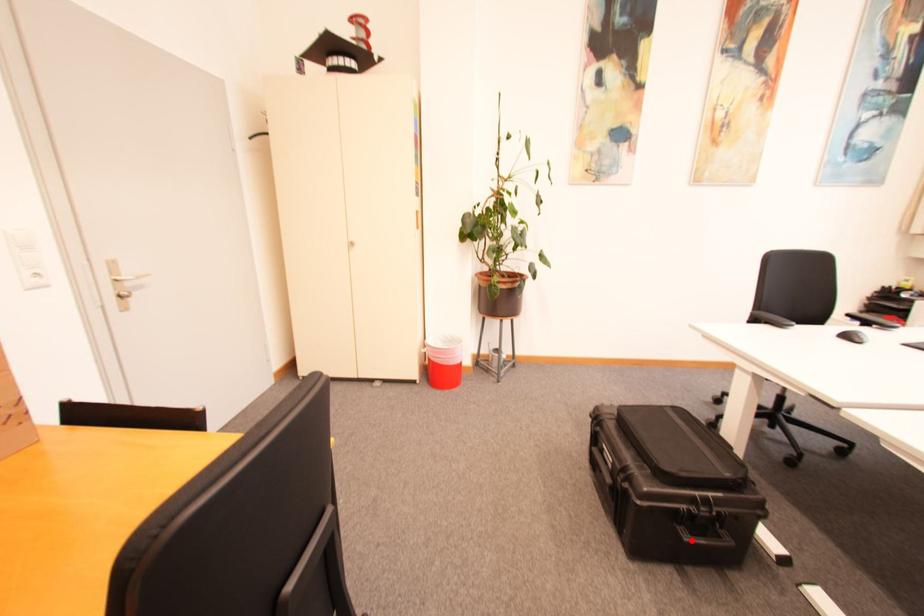
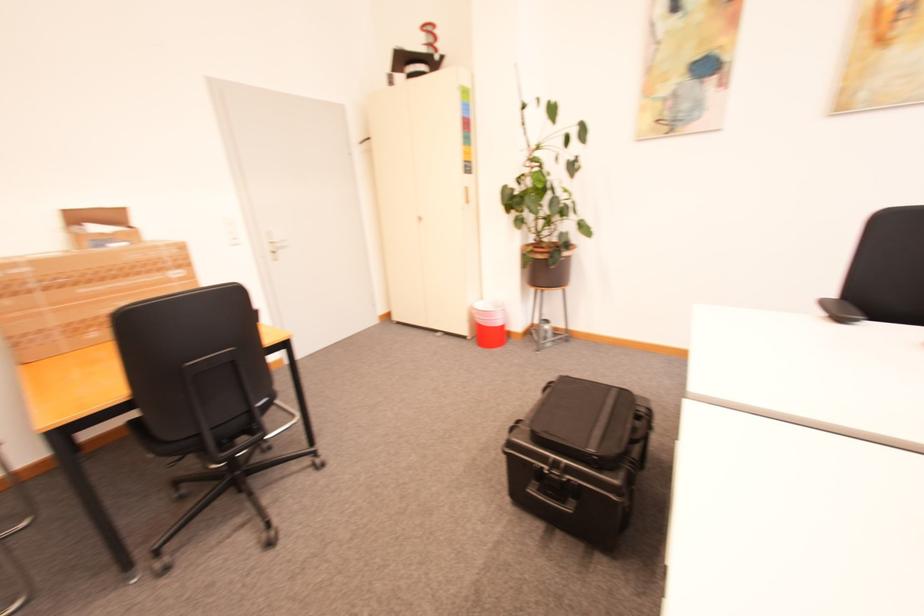
Question: I am providing you with two images of the same scene from different viewpoints. Given a red point in image1, look at the same physical point in image2. Is it:

Choices:
 (A) Closer to the viewpoint
 (B) Farther from the viewpoint

Answer: (B)